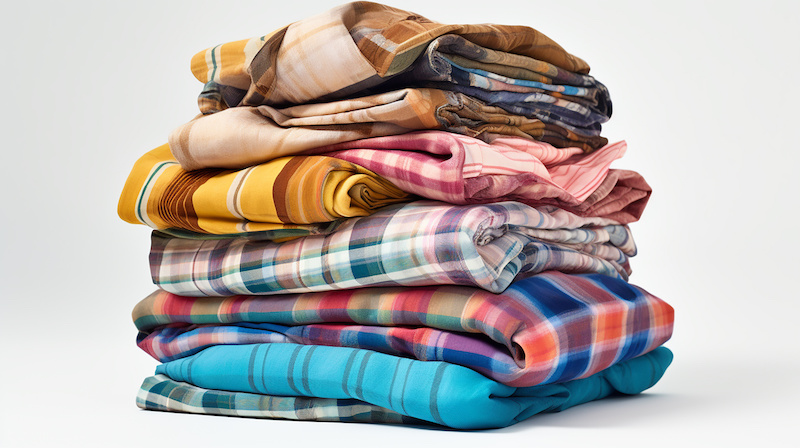
Find the location of a particular element. fabric stacked in a pile is located at coordinates (402, 45), (420, 154), (278, 210), (386, 243), (338, 315), (349, 380), (302, 422).